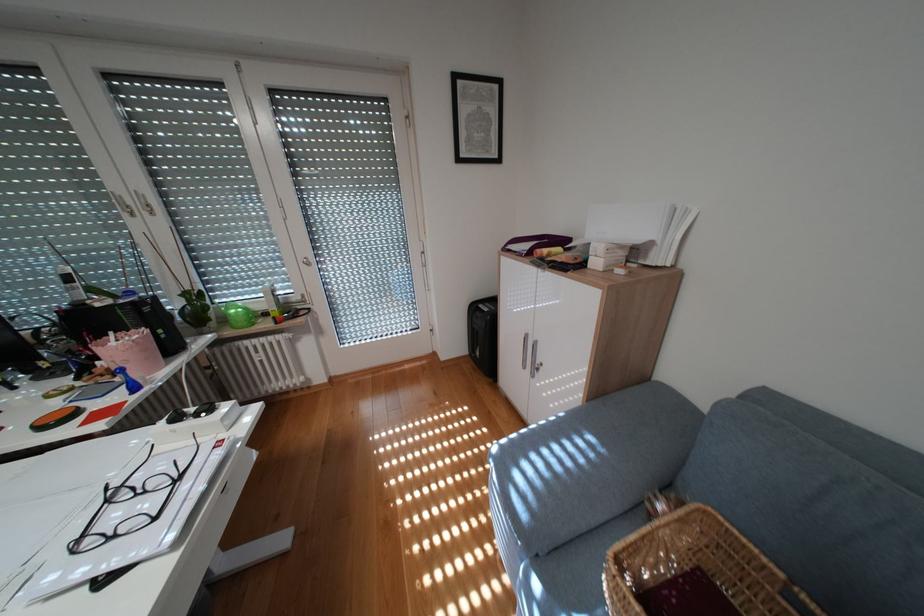
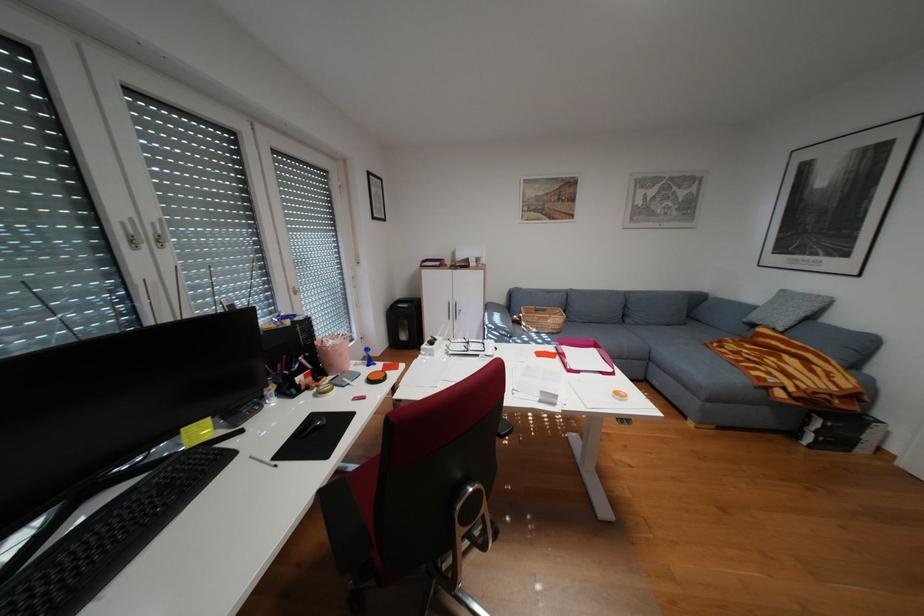
Locate, in the second image, the point that corresponds to (x=557, y=251) in the first image.

(460, 262)